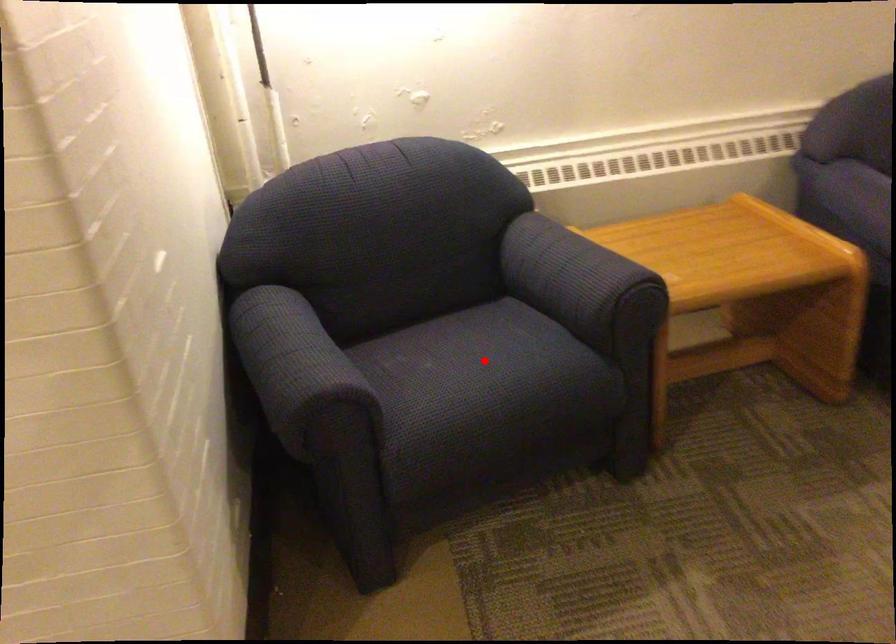
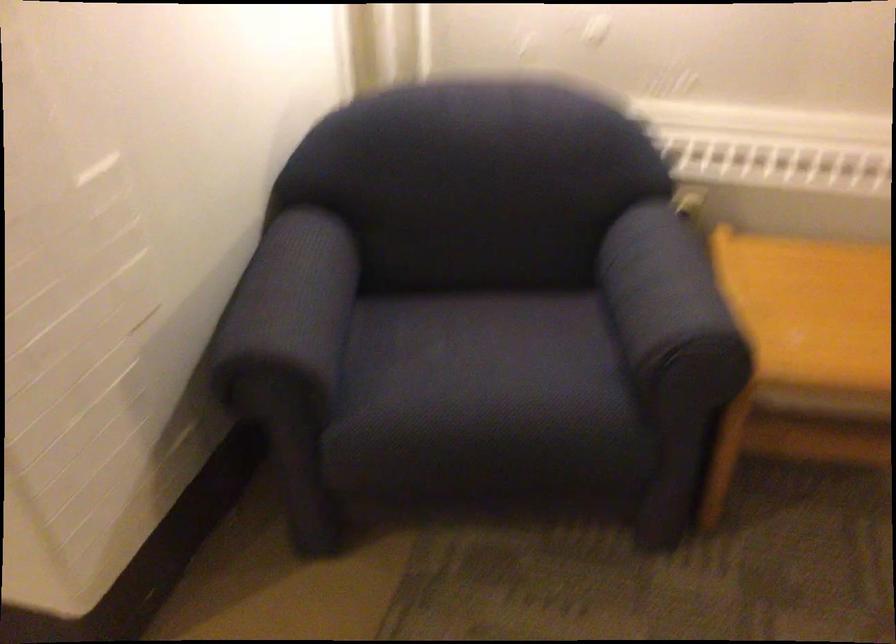
Where in the second image is the point corresponding to the highlighted location from the first image?

(485, 366)